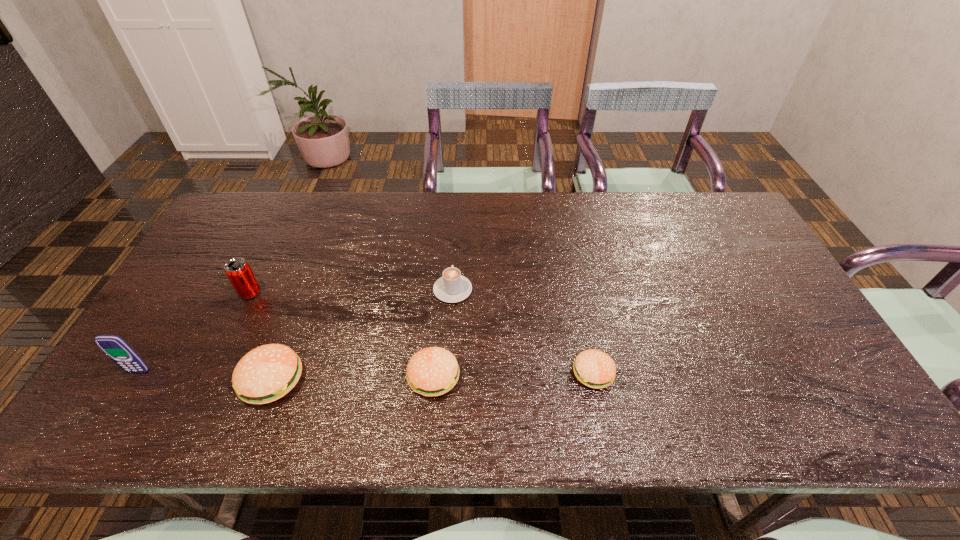
The width and height of the screenshot is (960, 540). What are the coordinates of `free space for a new patty on the right` in the screenshot? It's located at (751, 370).